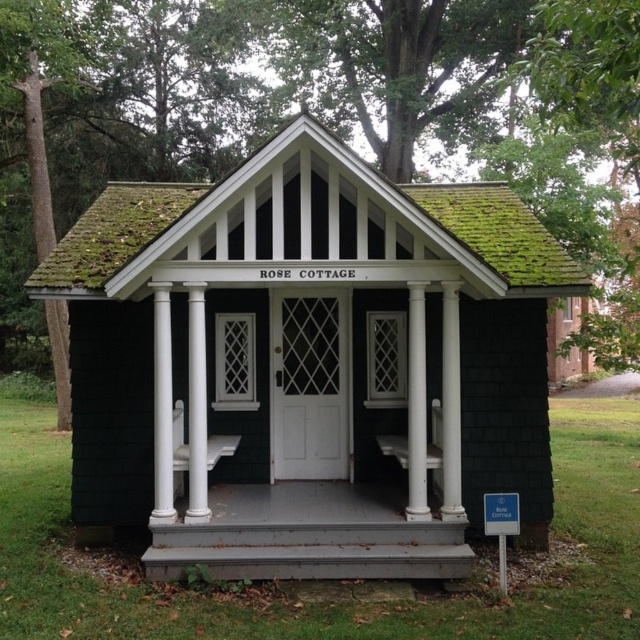
Can you confirm if black shingle cottage at center is shorter than gray wood porch at center?

No.

Is point (152, 200) behind point (243, 534)?

Yes, it is behind point (243, 534).

Is point (484, 308) farther from camera compared to point (368, 524)?

Yes, point (484, 308) is farther from viewer.

You are a GUI agent. You are given a task and a screenshot of the screen. Output one action in this format:
    pyautogui.click(x=<x>, y=<y>)
    Task: Click on the black shingle cottage at center
    The height and width of the screenshot is (640, 640).
    Given the screenshot: What is the action you would take?
    pyautogui.click(x=307, y=364)